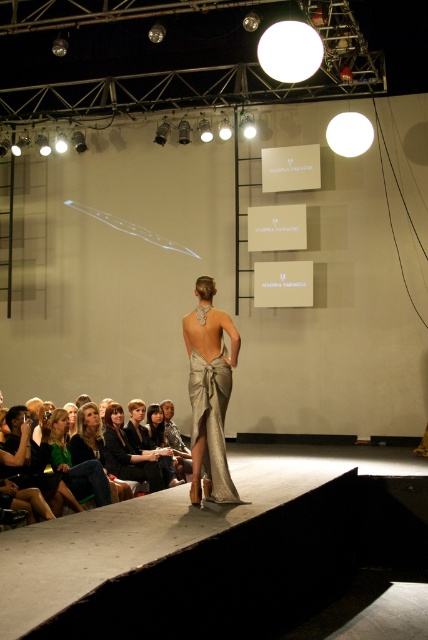
You are a photographer at the fashion show. You need to capture a photo where both the satin metallic dress at center and the green fabric dress at lower left are visible. Which direction should you position your camera to ensure both dresses are in frame?

Position your camera to the left of the satin metallic dress at center so that both it and the green fabric dress at lower left are visible, as the satin metallic dress at center is to the right of the green fabric dress at lower left.

You are a photographer at the fashion show and need to capture both the green fabric dress at lower left and the matte black dress at center in a single frame. Which dress should you focus on to ensure both are visible without cropping?

The green fabric dress at lower left is wider than the matte black dress at center, so focusing on the wider green fabric dress at lower left will ensure both dresses are visible in the frame.

Based on the scene description, which dress is narrower in width between the satin metallic dress at center and the green fabric dress at lower left?

The satin metallic dress at center has a lesser width compared to the green fabric dress at lower left, so it is narrower.